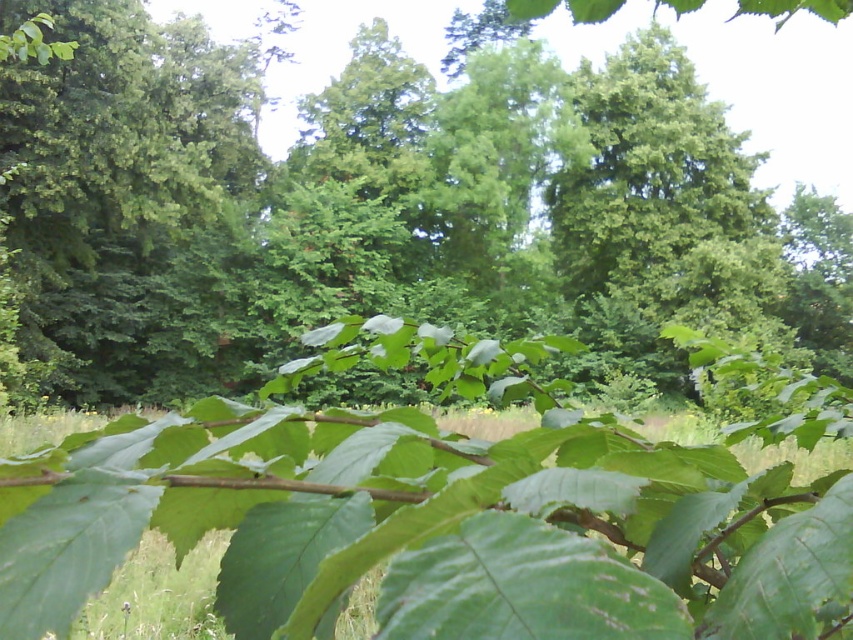
Question: Does green leafy branch at center appear over green leafy tree at upper center?

Choices:
 (A) yes
 (B) no

Answer: (A)

Question: Can you confirm if green leafy tree at upper center is smaller than green leafy grass at lower center?

Choices:
 (A) yes
 (B) no

Answer: (B)

Question: Among these objects, which one is nearest to the camera?

Choices:
 (A) green leafy grass at lower center
 (B) green leafy branch at center
 (C) green leafy tree at upper center

Answer: (A)

Question: Is green leafy branch at center further to the viewer compared to green leafy grass at lower center?

Choices:
 (A) no
 (B) yes

Answer: (B)

Question: Estimate the real-world distances between objects in this image. Which object is farther from the green leafy branch at center?

Choices:
 (A) green leafy grass at lower center
 (B) green leafy tree at upper center

Answer: (A)

Question: Which object is farther from the camera taking this photo?

Choices:
 (A) green leafy branch at center
 (B) green leafy tree at upper center

Answer: (B)